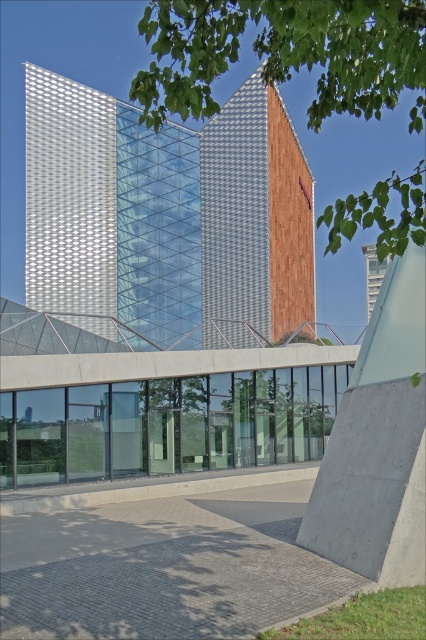
You are standing at the entrance of the modern architectural structure and want to reach the metallic grid tower at center. According to the image, in which direction should you move relative to your current position?

The metallic grid tower at center is located at point coordinates, so you should move towards the center of the image to reach it.

You are a construction worker planning to place a new 20 meter long steel beam between the metallic grid tower at center and the white glass tower at upper center. Based on the scene, will the beam fit between them without exceeding the available space?

The distance between the metallic grid tower at center and the white glass tower at upper center is 21.24 meters. Since the beam is 20 meters long, it will fit with 1.24 meters of space remaining.